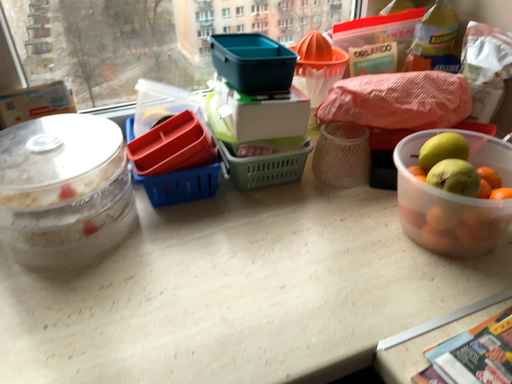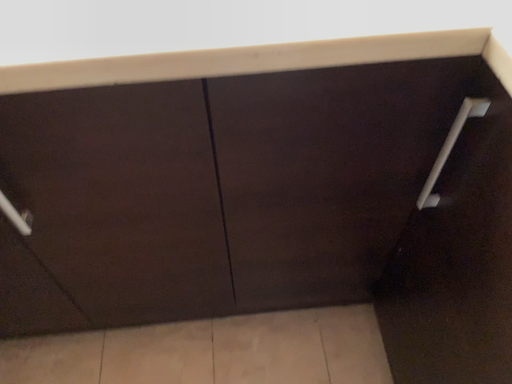
Question: Which way did the camera rotate in the video?

Choices:
 (A) rotated left
 (B) rotated right

Answer: (A)